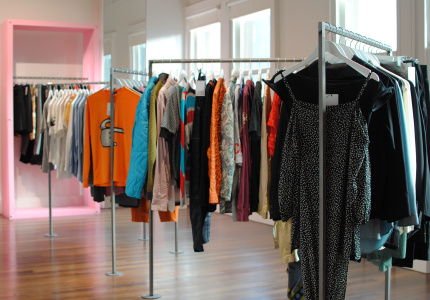
At what (x,y) coordinates should I click in order to perform the action: click on hardwood floor. Please return your answer as a coordinate pair (x, y). Looking at the image, I should click on (231, 284), (19, 248), (411, 284).